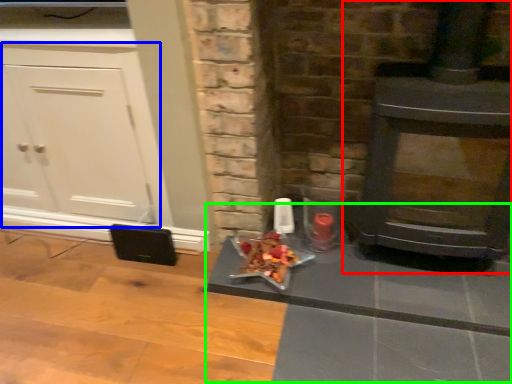
Question: Which object is positioned closest to wood burning stove (highlighted by a red box)? Select from cabinetry (highlighted by a blue box) and table (highlighted by a green box).

Choices:
 (A) cabinetry
 (B) table

Answer: (B)